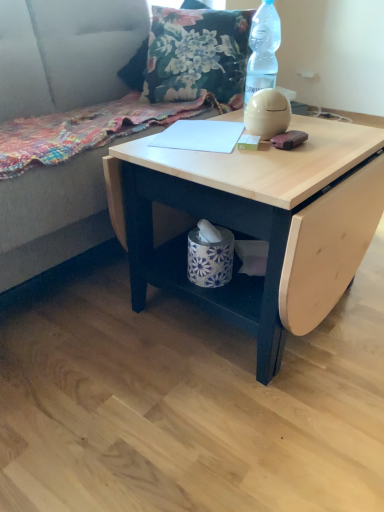
Locate an element on the screen. Image resolution: width=384 pixels, height=512 pixels. free space to the left of light wood table at center is located at coordinates (79, 331).